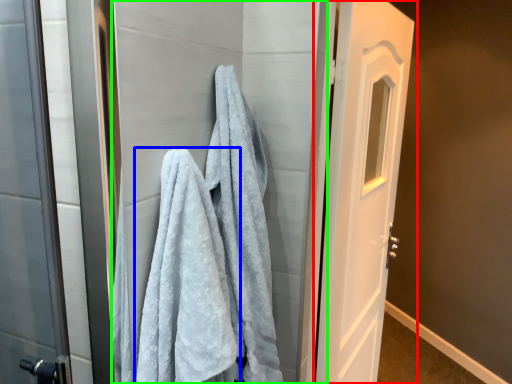
Question: Estimate the real-world distances between objects in this image. Which object is farther from door (highlighted by a red box), towel (highlighted by a blue box) or screen door (highlighted by a green box)?

Choices:
 (A) towel
 (B) screen door

Answer: (A)